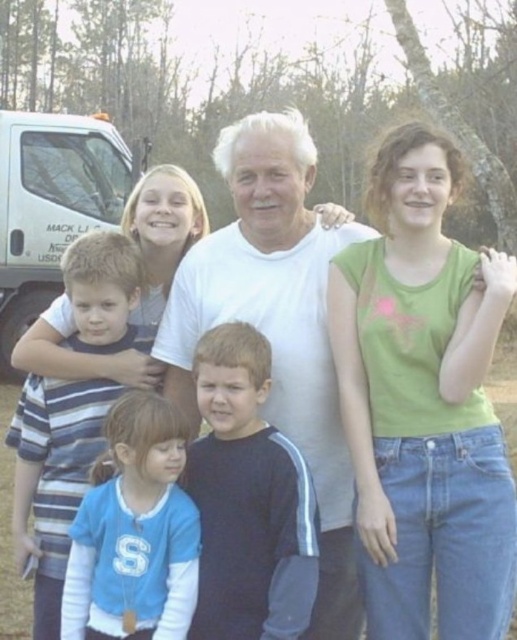
Question: Is green cotton shirt at right bigger than matte white shirt at upper center?

Choices:
 (A) yes
 (B) no

Answer: (A)

Question: Among these objects, which one is farthest from the camera?

Choices:
 (A) black fleece at center
 (B) green cotton shirt at right
 (C) striped cotton shirt at left

Answer: (C)

Question: Which of the following is the farthest from the observer?

Choices:
 (A) white matte shirt at center
 (B) blue fleece jacket at lower left

Answer: (A)

Question: From the image, what is the correct spatial relationship of green cotton shirt at right in relation to white matte shirt at center?

Choices:
 (A) right
 (B) left

Answer: (A)

Question: Which point is farther to the camera?

Choices:
 (A) striped cotton shirt at left
 (B) blue fleece jacket at lower left

Answer: (A)

Question: Can you confirm if green cotton shirt at right is positioned to the right of blue fleece jacket at lower left?

Choices:
 (A) no
 (B) yes

Answer: (B)